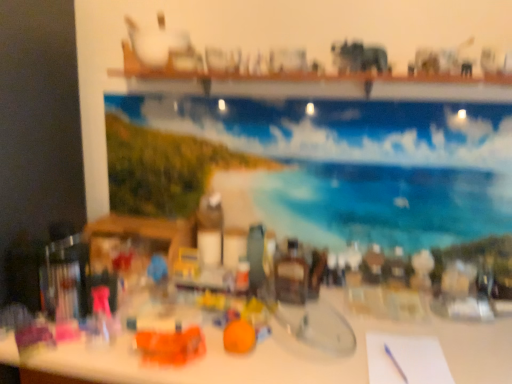
Locate an element on the screen. The width and height of the screenshot is (512, 384). vacant space underneath white paper at lower right (from a real-world perspective) is located at coordinates (408, 362).